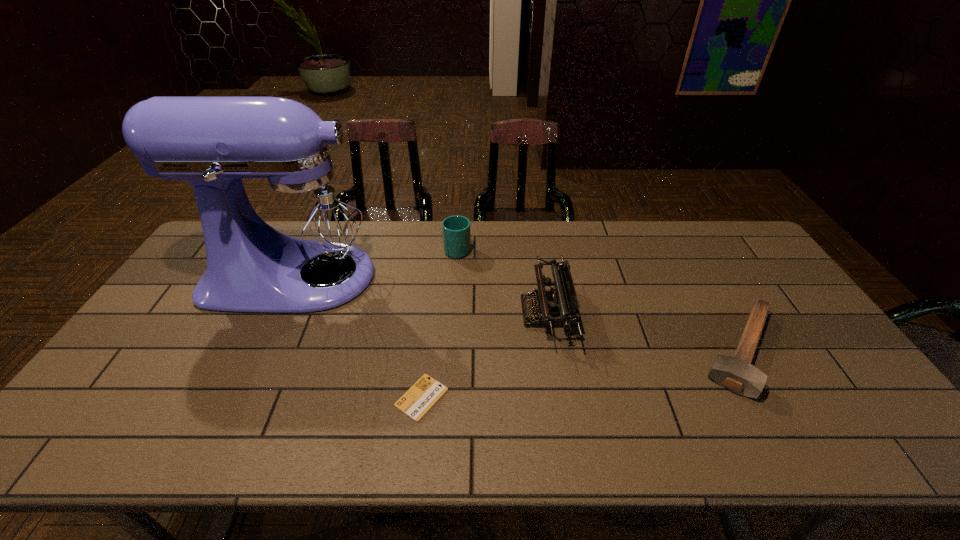
You are a GUI agent. You are given a task and a screenshot of the screen. Output one action in this format:
    pyautogui.click(x=<x>, y=<y>)
    Task: Click on the object present at the far left corner
    The image size is (960, 540).
    Given the screenshot: What is the action you would take?
    pyautogui.click(x=296, y=239)

In the image, there is a desktop. Where is `free space at the far edge`? Image resolution: width=960 pixels, height=540 pixels. free space at the far edge is located at coordinates (481, 237).

In the image, there is a desktop. Where is `vacant space at the near edge`? The image size is (960, 540). vacant space at the near edge is located at coordinates (282, 421).

This screenshot has height=540, width=960. In order to click on free space at the left edge of the desktop in this screenshot , I will do `click(118, 416)`.

The image size is (960, 540). I want to click on free region at the right edge of the desktop, so click(x=845, y=370).

The image size is (960, 540). Identify the location of blank space at the far right corner of the desktop. (744, 235).

Image resolution: width=960 pixels, height=540 pixels. I want to click on vacant space in between the shortest object and the cup, so click(x=440, y=323).

At what (x,y) coordinates should I click in order to perform the action: click on vacant point located between the mallet and the second object from right to left. Please return your answer as a coordinate pair (x, y). This screenshot has height=540, width=960. Looking at the image, I should click on (644, 332).

I want to click on free space between the cup and the shortest object, so [440, 323].

Find the location of a particular element. Image resolution: width=960 pixels, height=540 pixels. vacant space that's between the shortest object and the second object from right to left is located at coordinates (484, 355).